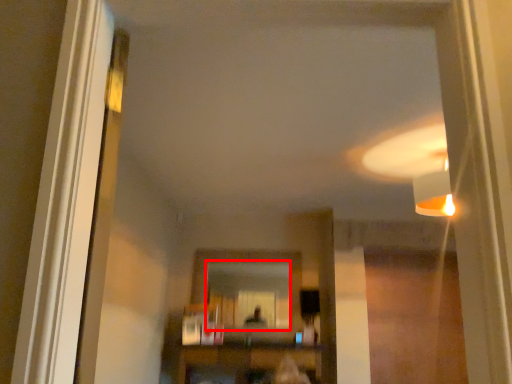
Question: Observing the image, what is the correct spatial positioning of mirror (annotated by the red box) in reference to furniture?

Choices:
 (A) right
 (B) left

Answer: (B)